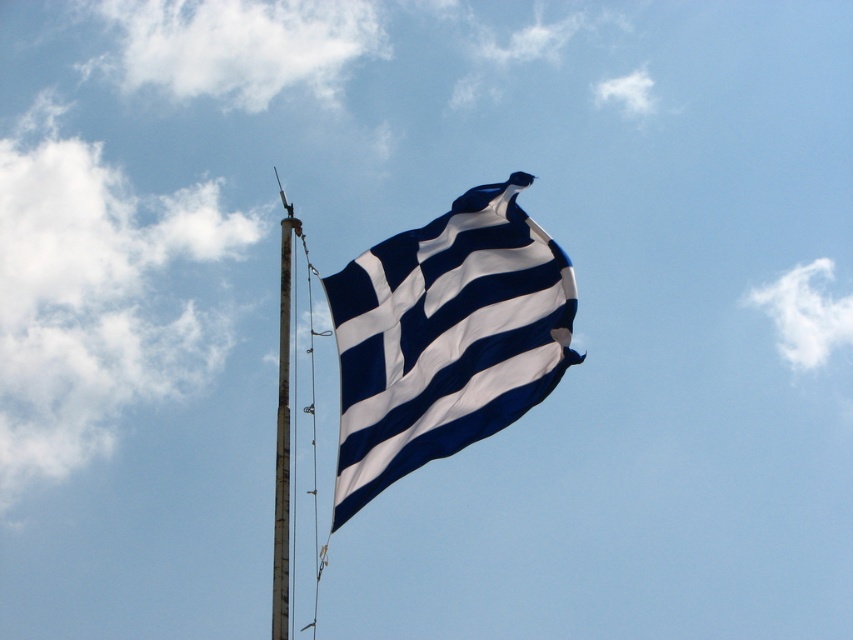
Question: Is blue/white fabric flag at center in front of smooth metal pole at center?

Choices:
 (A) no
 (B) yes

Answer: (A)

Question: Which point is farther from the camera taking this photo?

Choices:
 (A) (384, 420)
 (B) (287, 602)

Answer: (A)

Question: In this image, where is blue/white fabric flag at center located relative to smooth metal pole at center?

Choices:
 (A) below
 (B) above

Answer: (B)

Question: Is blue/white fabric flag at center above smooth metal pole at center?

Choices:
 (A) no
 (B) yes

Answer: (B)

Question: Which of the following is the farthest from the observer?

Choices:
 (A) blue/white fabric flag at center
 (B) smooth metal pole at center

Answer: (A)

Question: Which point is closer to the camera?

Choices:
 (A) [x=276, y=512]
 (B) [x=374, y=308]

Answer: (A)